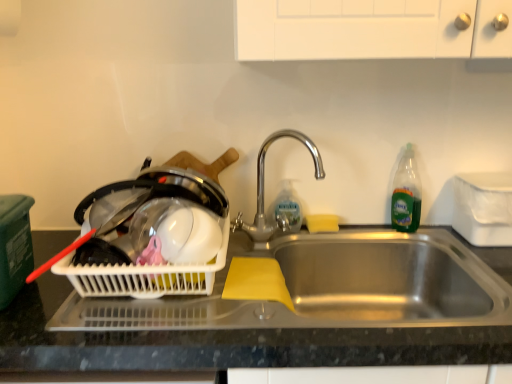
Question: Considering the relative sizes of stainless steel sink at center and white plastic container at right in the image provided, is stainless steel sink at center bigger than white plastic container at right?

Choices:
 (A) yes
 (B) no

Answer: (A)

Question: From the image's perspective, is stainless steel sink at center below white plastic container at right?

Choices:
 (A) yes
 (B) no

Answer: (A)

Question: Considering the relative sizes of stainless steel sink at center and white plastic container at right in the image provided, is stainless steel sink at center wider than white plastic container at right?

Choices:
 (A) yes
 (B) no

Answer: (A)

Question: Is white plastic container at right surrounded by stainless steel sink at center?

Choices:
 (A) yes
 (B) no

Answer: (B)

Question: From a real-world perspective, is stainless steel sink at center beneath white plastic container at right?

Choices:
 (A) yes
 (B) no

Answer: (A)

Question: Is white plastic container at right inside or outside of yellow sponge at sink?

Choices:
 (A) inside
 (B) outside

Answer: (B)

Question: Would you say white plastic container at right is to the left or to the right of yellow sponge at sink in the picture?

Choices:
 (A) left
 (B) right

Answer: (B)

Question: From their relative heights in the image, would you say white plastic container at right is taller or shorter than yellow sponge at sink?

Choices:
 (A) tall
 (B) short

Answer: (A)

Question: From the image's perspective, is white plastic container at right located above or below yellow sponge at sink?

Choices:
 (A) above
 (B) below

Answer: (A)

Question: Considering their positions, is white plastic container at right located in front of or behind green translucent bottle at right, which is the second bottle from left to right?

Choices:
 (A) behind
 (B) front

Answer: (B)

Question: Choose the correct answer: Is white plastic container at right inside green translucent bottle at right, the 1th bottle when ordered from right to left, or outside it?

Choices:
 (A) inside
 (B) outside

Answer: (B)

Question: Considering the positions of white plastic container at right and green translucent bottle at right, the 1th bottle when ordered from right to left, in the image, is white plastic container at right taller or shorter than green translucent bottle at right, the 1th bottle when ordered from right to left,?

Choices:
 (A) short
 (B) tall

Answer: (A)

Question: From the image's perspective, is white plastic container at right above or below green translucent bottle at right, which is the second bottle from left to right?

Choices:
 (A) below
 (B) above

Answer: (A)

Question: In terms of height, does clear plastic bottle at sink, which is the second bottle from right to left, look taller or shorter compared to polished metal faucet at center?

Choices:
 (A) short
 (B) tall

Answer: (A)

Question: Considering the positions of point (296, 215) and point (274, 226), is point (296, 215) closer or farther from the camera than point (274, 226)?

Choices:
 (A) farther
 (B) closer

Answer: (B)